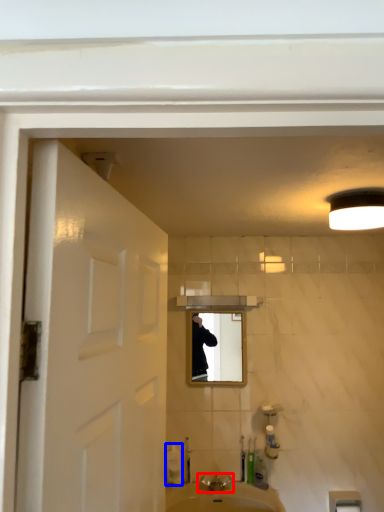
Question: Which point is further to the camera, tap (highlighted by a red box) or soap dispenser (highlighted by a blue box)?

Choices:
 (A) tap
 (B) soap dispenser

Answer: (B)